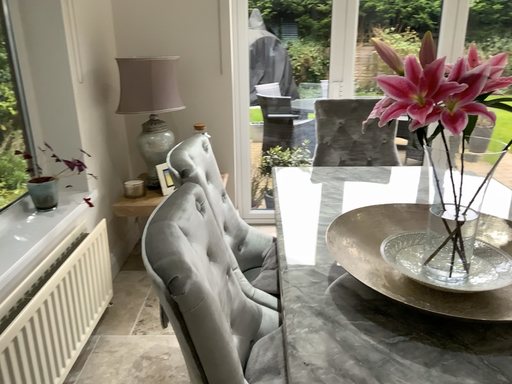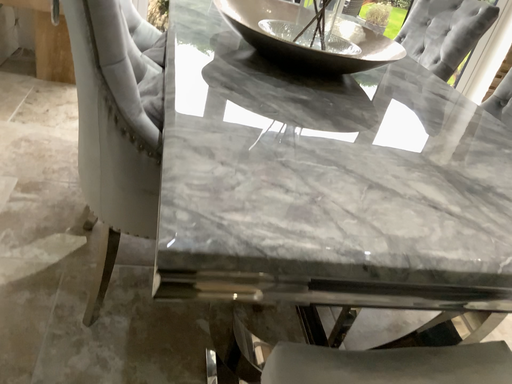
Question: How did the camera likely rotate when shooting the video?

Choices:
 (A) rotated upward
 (B) rotated downward

Answer: (B)